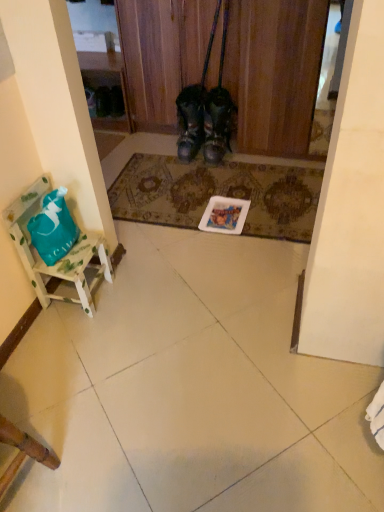
The image size is (384, 512). Find the location of `vacant space positioned to the left of leather boots at center, the second footwear viewed from the right`. vacant space positioned to the left of leather boots at center, the second footwear viewed from the right is located at coordinates (157, 152).